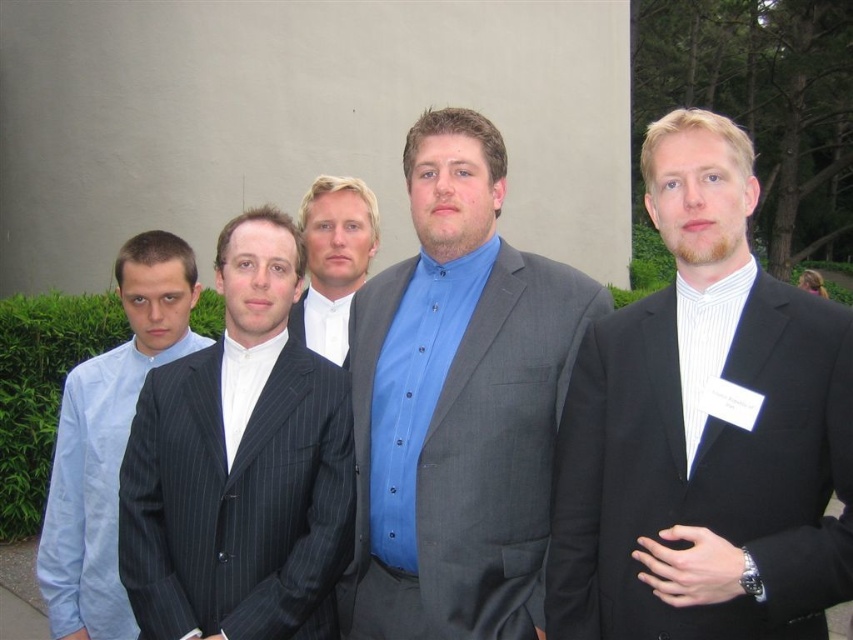
Question: Which point appears closest to the camera in this image?

Choices:
 (A) (848, 452)
 (B) (257, 406)
 (C) (434, 196)

Answer: (A)

Question: Which of these objects is positioned farthest from the dark gray pinstripe suit at center?

Choices:
 (A) light blue shirt at left
 (B) white shirt at center

Answer: (B)

Question: Observing the image, what is the correct spatial positioning of black pinstripe suit at right in reference to matte blue shirt at center?

Choices:
 (A) right
 (B) left

Answer: (A)

Question: Which object is positioned closest to the black pinstripe suit at right?

Choices:
 (A) white shirt at center
 (B) dark gray pinstripe suit at center
 (C) light blue shirt at left

Answer: (B)

Question: Can you confirm if black pinstripe suit at right is positioned above matte blue shirt at center?

Choices:
 (A) yes
 (B) no

Answer: (A)

Question: Is black pinstripe suit at right smaller than matte blue shirt at center?

Choices:
 (A) yes
 (B) no

Answer: (A)